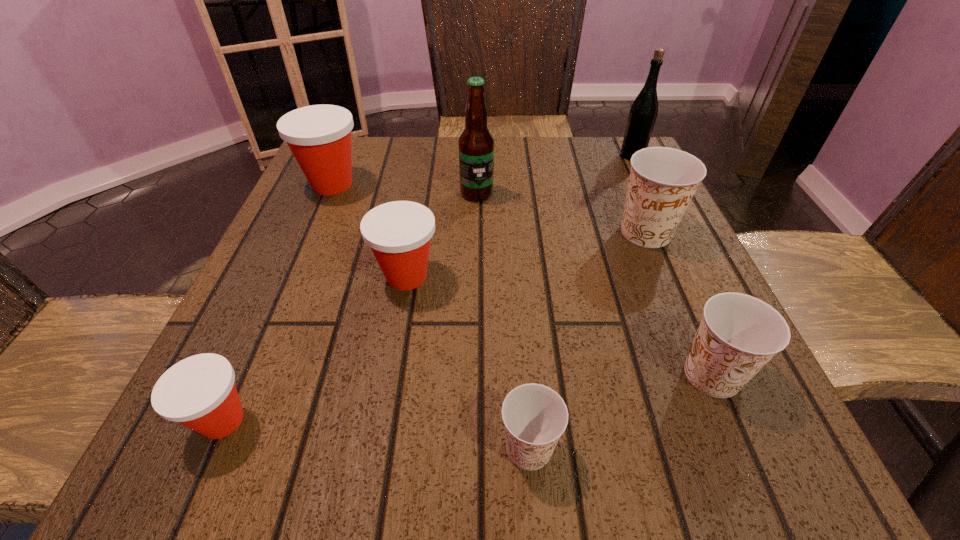
Locate an element on the screen. the second nearest orange Dixie cup is located at coordinates (738, 334).

At what (x,y) coordinates should I click in order to perform the action: click on the smallest red-orange Dixie cup. Please return your answer as a coordinate pair (x, y). Looking at the image, I should click on (199, 392).

Where is `the fourth Dixie cup from left to right`? Image resolution: width=960 pixels, height=540 pixels. the fourth Dixie cup from left to right is located at coordinates (535, 416).

This screenshot has width=960, height=540. In order to click on the smallest orange Dixie cup in this screenshot , I will do `click(535, 416)`.

Locate an element on the screen. free space located 0.110m on the left of the green beer bottle is located at coordinates (575, 156).

Locate an element on the screen. free space located 0.060m on the label of the brown beer bottle is located at coordinates coord(476,221).

Find the location of `free region located 0.360m on the right of the biggest red-orange Dixie cup`. free region located 0.360m on the right of the biggest red-orange Dixie cup is located at coordinates (527, 184).

At what (x,y) coordinates should I click in order to perform the action: click on vacant area located on the back of the fifth nearest object. Please return your answer as a coordinate pair (x, y). This screenshot has height=540, width=960. Looking at the image, I should click on (621, 173).

The width and height of the screenshot is (960, 540). In order to click on blank space located 0.070m on the left of the fourth Dixie cup from right to left in this screenshot , I will do `click(333, 276)`.

At what (x,y) coordinates should I click in order to perform the action: click on vacant space situated on the left of the second biggest orange Dixie cup. Please return your answer as a coordinate pair (x, y). Looking at the image, I should click on (412, 375).